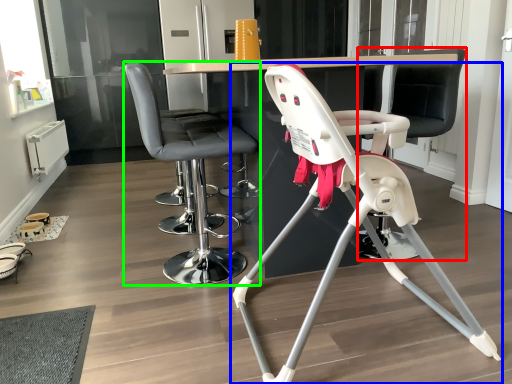
Question: Which object is positioned farthest from swivel chair (highlighted by a red box)? Select from chair (highlighted by a blue box) and chair (highlighted by a green box).

Choices:
 (A) chair
 (B) chair

Answer: (B)